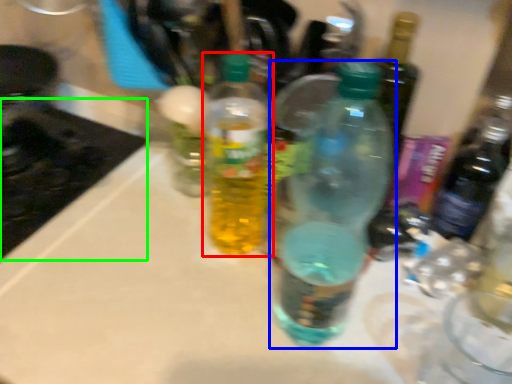
Question: Based on their relative distances, which object is nearer to bottle (highlighted by a red box)? Choose from bottle (highlighted by a blue box) and appliance (highlighted by a green box).

Choices:
 (A) bottle
 (B) appliance

Answer: (A)